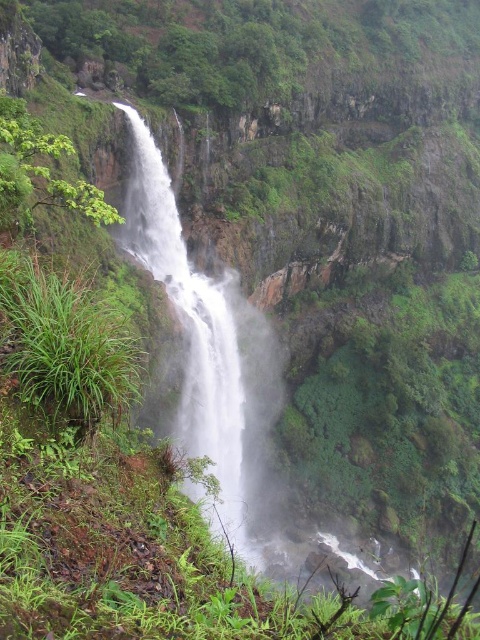
Question: Is green leafy vegetation at upper center to the left of white misty waterfall at center from the viewer's perspective?

Choices:
 (A) no
 (B) yes

Answer: (A)

Question: Which object is the farthest from the white misty waterfall at center?

Choices:
 (A) green leafy plant at left
 (B) green leafy vegetation at upper center

Answer: (B)

Question: Is green leafy vegetation at upper center above green leafy plant at left?

Choices:
 (A) no
 (B) yes

Answer: (B)

Question: Which point is farther from the camera taking this photo?

Choices:
 (A) (431, 20)
 (B) (24, 180)

Answer: (A)

Question: Which object appears closest to the camera in this image?

Choices:
 (A) green leafy vegetation at upper center
 (B) white misty waterfall at center

Answer: (B)

Question: Is green leafy vegetation at upper center to the right of white misty waterfall at center from the viewer's perspective?

Choices:
 (A) yes
 (B) no

Answer: (A)